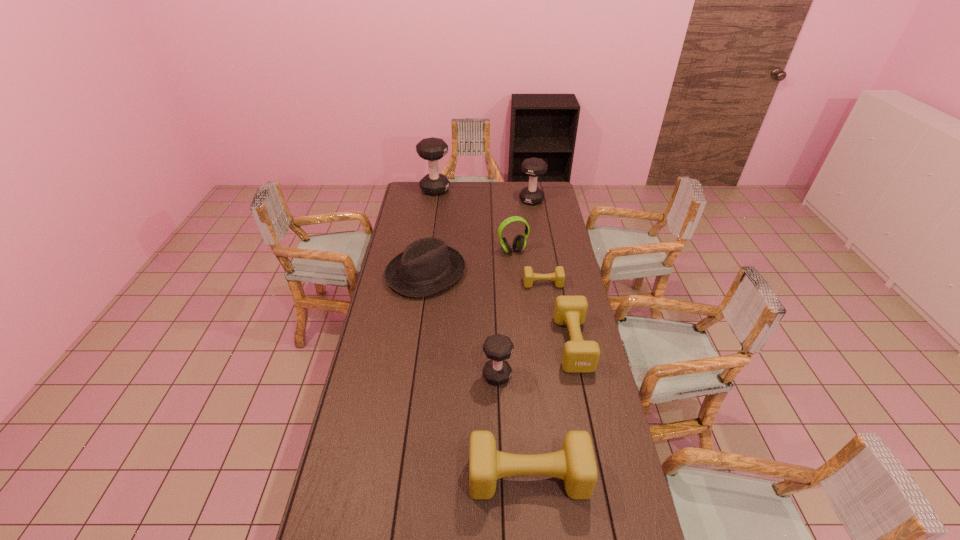
Locate an element on the screen. This screenshot has height=540, width=960. blank region between the smallest olive dumbbell and the gray fedora is located at coordinates (485, 278).

Identify the location of vacant area between the leftmost gray dumbbell and the shortest object. (489, 237).

Identify the location of vacant space that's between the nearest olive dumbbell and the second tallest object. (530, 339).

At what (x,y) coordinates should I click in order to perform the action: click on blank region between the gray fedora and the nearest object. Please return your answer as a coordinate pair (x, y). The width and height of the screenshot is (960, 540). Looking at the image, I should click on (477, 375).

You are a GUI agent. You are given a task and a screenshot of the screen. Output one action in this format:
    pyautogui.click(x=<x>, y=<y>)
    Task: Click on the vacant area between the biggest gray dumbbell and the rightmost gray dumbbell
    This screenshot has width=960, height=540.
    Given the screenshot: What is the action you would take?
    pyautogui.click(x=483, y=195)

This screenshot has height=540, width=960. Identify the location of the sixth closest object to the tallest dumbbell. (498, 348).

Locate which object ranks fifth in proximity to the fedora. Please provide its 2D coordinates. Your answer should be formatted as a tuple, i.e. [(x, y)], where the tuple contains the x and y coordinates of a point satisfying the conditions above.

[(533, 167)]

Identify which dumbbell is located as the second nearest to the leftmost gray dumbbell. Please provide its 2D coordinates. Your answer should be formatted as a tuple, i.e. [(x, y)], where the tuple contains the x and y coordinates of a point satisfying the conditions above.

[(558, 276)]

At what (x,y) coordinates should I click in order to perform the action: click on dumbbell that stands as the third closest to the second shortest dumbbell. Please return your answer as a coordinate pair (x, y). This screenshot has height=540, width=960. Looking at the image, I should click on (575, 464).

Identify which gray dumbbell is the closest to the headset. Please provide its 2D coordinates. Your answer should be formatted as a tuple, i.e. [(x, y)], where the tuple contains the x and y coordinates of a point satisfying the conditions above.

[(533, 167)]